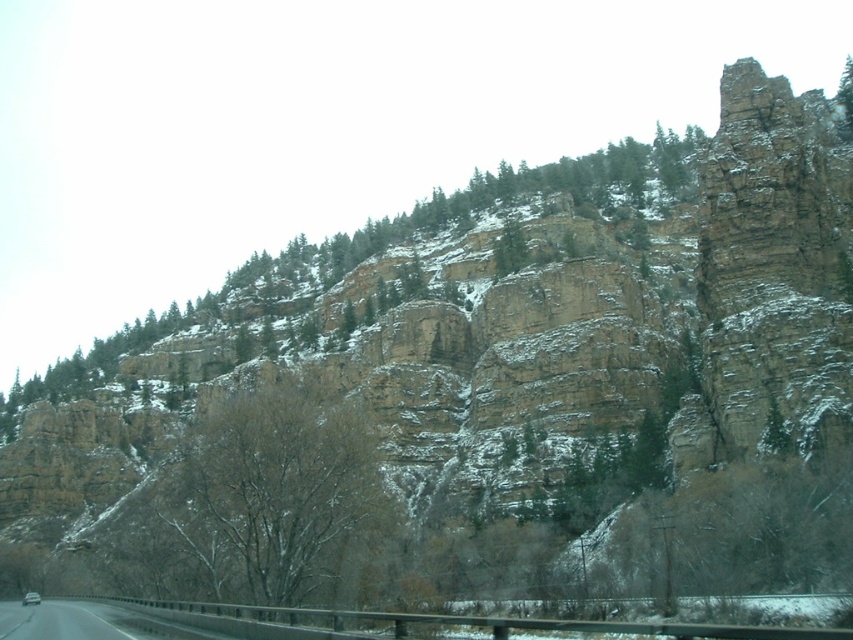
Looking at this image, you are a hiker planning to take a photo of the green textured tree at upper right and the bare branches at center. From your current position, which object should you move towards first to ensure both are in the frame?

You should move towards the bare branches at center first because it is closer to your position than the green textured tree at upper right, as the bare branches at center is to the left of the green textured tree at upper right.

You are a hiker planning to take a photo of the bare branches at center and the green textured tree at upper right from the road below. Which tree should you focus on first if you want to capture both in a single frame without moving your camera?

The bare branches at center is shorter than the green textured tree at upper right, so you should focus on the green textured tree at upper right first as it is taller and might occupy more of the frame.